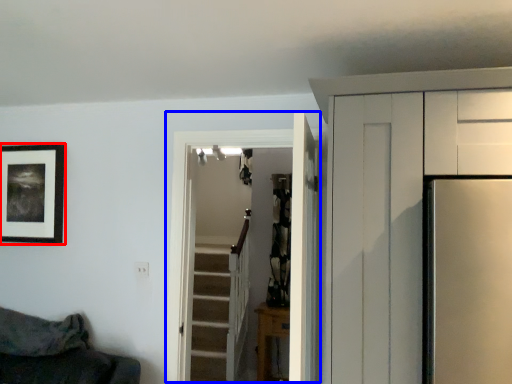
Question: Which object appears closest to the camera in this image, picture frame (highlighted by a red box) or door (highlighted by a blue box)?

Choices:
 (A) picture frame
 (B) door

Answer: (B)